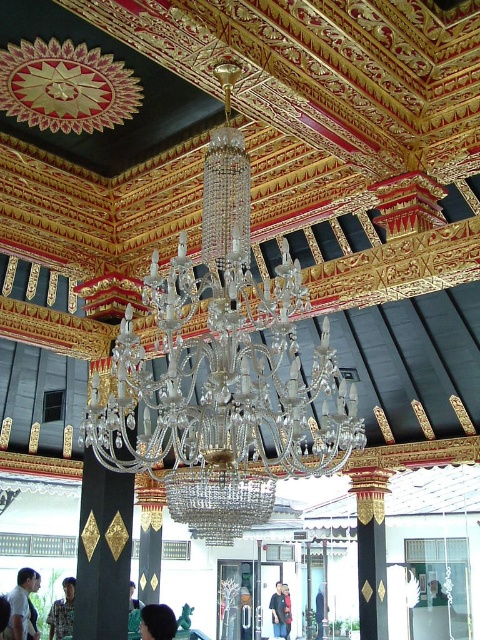
You are standing in the ceremonial hall and see the dark brown hair at center and the black fabric person at center. Which one is positioned higher?

The dark brown hair at center is above the black fabric person at center.

You are standing in the ceremonial hall and see the dark brown hair at center and the green fabric person at lower center. Which one is closer to you?

The dark brown hair at center is closer to you because it is further to the viewer than the green fabric person at lower center.

You are an interior designer observing the scene. You notice the dark brown hair at center and the green fabric person at lower center. Based on their positions, which object is positioned higher in the image?

The dark brown hair at center is located above the green fabric person at lower center, so it is positioned higher in the image.